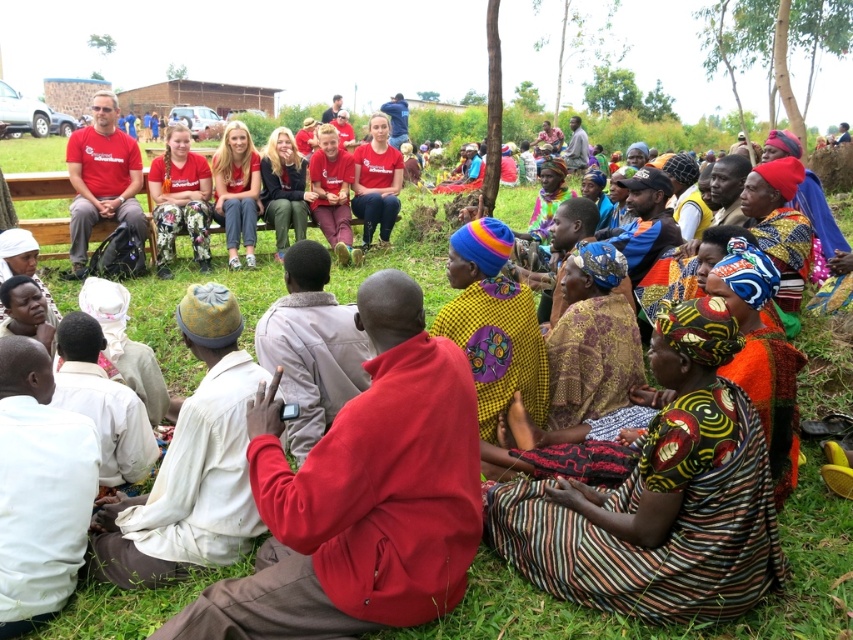
Between point (552, 422) and point (758, 193), which one is positioned behind?

The point (758, 193) is more distant.

Who is shorter, patterned fabric dress at center or multicolored woven cloth at center?

patterned fabric dress at center

Find the location of `patterned fabric dress at center`. patterned fabric dress at center is located at coordinates (592, 339).

At what (x,y) coordinates should I click in order to perform the action: click on patterned fabric dress at center. Please return your answer as a coordinate pair (x, y). The width and height of the screenshot is (853, 640). Looking at the image, I should click on (592, 339).

Between point (498, 330) and point (595, 250), which one is positioned behind?

The point (595, 250) is more distant.

Does point (486, 349) lie in front of point (575, 330)?

That is True.

Which is in front, point (474, 349) or point (605, 326)?

Positioned in front is point (474, 349).

The image size is (853, 640). Identify the location of yellow printed fabric at center. (492, 323).

Does striped fabric dress at lower right have a greater width compared to patterned fabric dress at center?

Correct, the width of striped fabric dress at lower right exceeds that of patterned fabric dress at center.

Between striped fabric dress at lower right and patterned fabric dress at center, which one appears on the left side from the viewer's perspective?

Positioned to the left is patterned fabric dress at center.

Between point (517, 556) and point (630, 368), which one is positioned behind?

Point (630, 368)

Where is `striped fabric dress at lower right`? striped fabric dress at lower right is located at coordinates (660, 497).